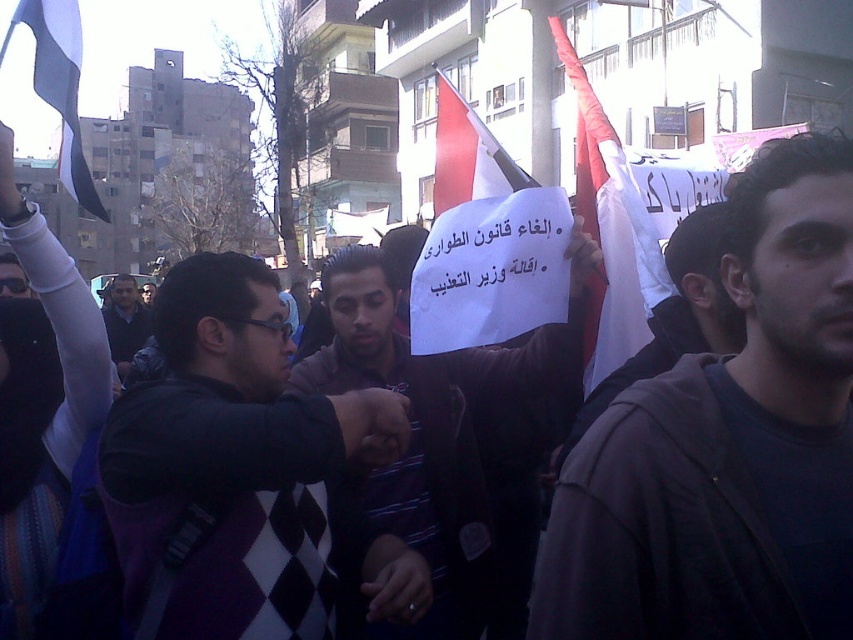
Question: Can you confirm if white paper sign at center is positioned to the right of dark blue sweater at center?

Choices:
 (A) yes
 (B) no

Answer: (A)

Question: Estimate the real-world distances between objects in this image. Which object is farther from the dark brown sweater at center?

Choices:
 (A) dark blue sweater at center
 (B) white paper sign at center

Answer: (A)

Question: Does white fabric flag at upper left appear on the left side of dark blue sweater at center?

Choices:
 (A) yes
 (B) no

Answer: (B)

Question: Does dark brown leather jacket at center appear over white fabric flag at center?

Choices:
 (A) no
 (B) yes

Answer: (A)

Question: Among these points, which one is farthest from the camera?

Choices:
 (A) (811, 214)
 (B) (393, 280)
 (C) (582, 147)
 (D) (701, 278)

Answer: (C)

Question: Which point is closer to the camera?

Choices:
 (A) dark brown sweater at center
 (B) white paper sign at center
 (C) dark brown leather jacket at center

Answer: (C)